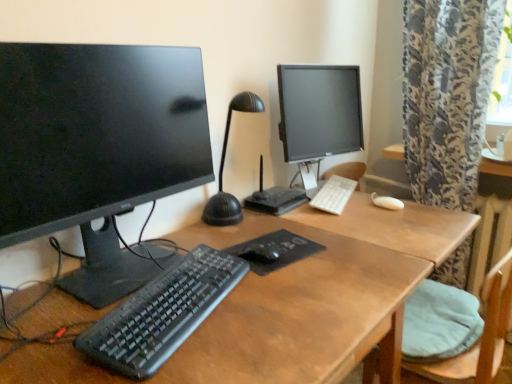
Image resolution: width=512 pixels, height=384 pixels. I want to click on free space between white plastic keyboard at center, placed as the 2th computer keyboard when sorted from bottom to top, and black textured mousepad at center, so pyautogui.click(x=298, y=221).